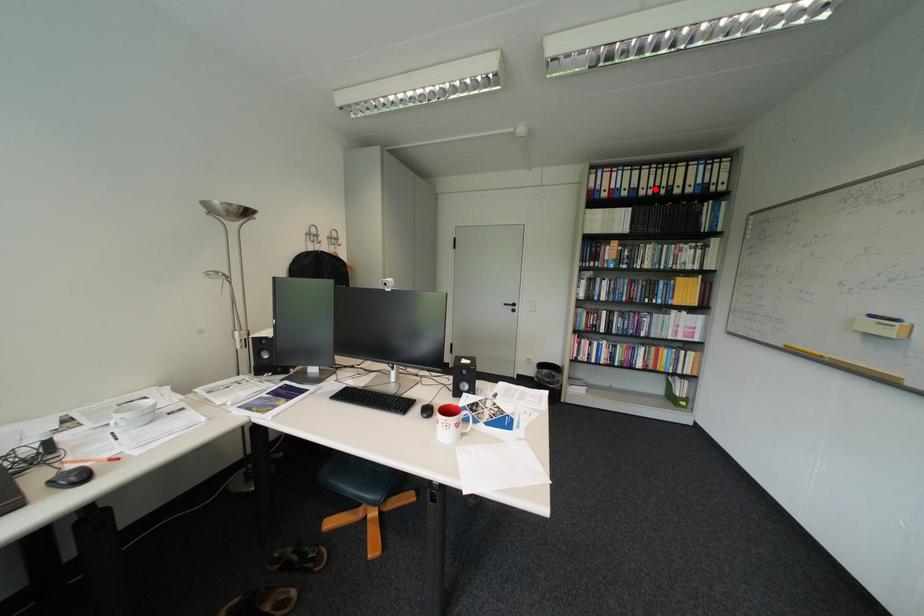
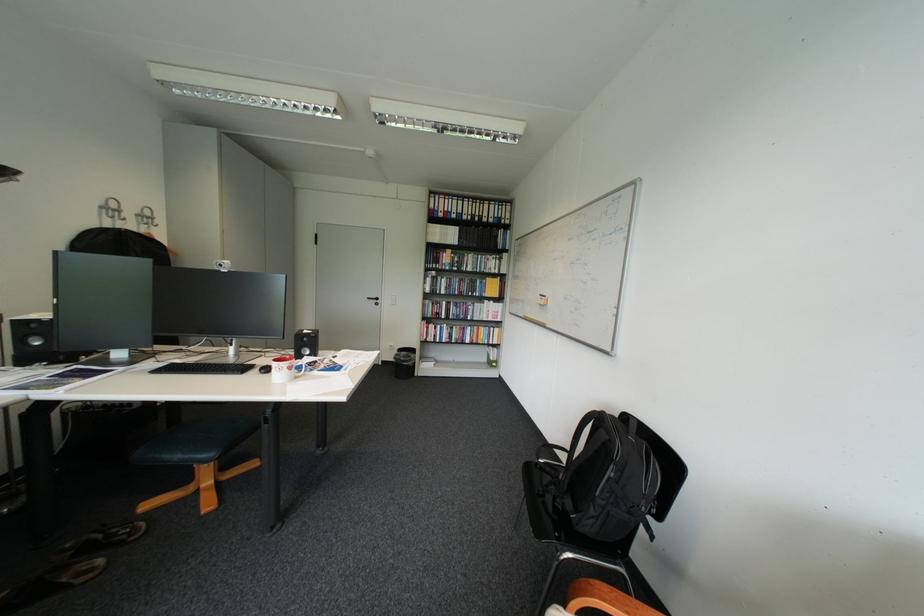
Where in the second image is the point corresponding to the highlighted location from the first image?

(477, 215)